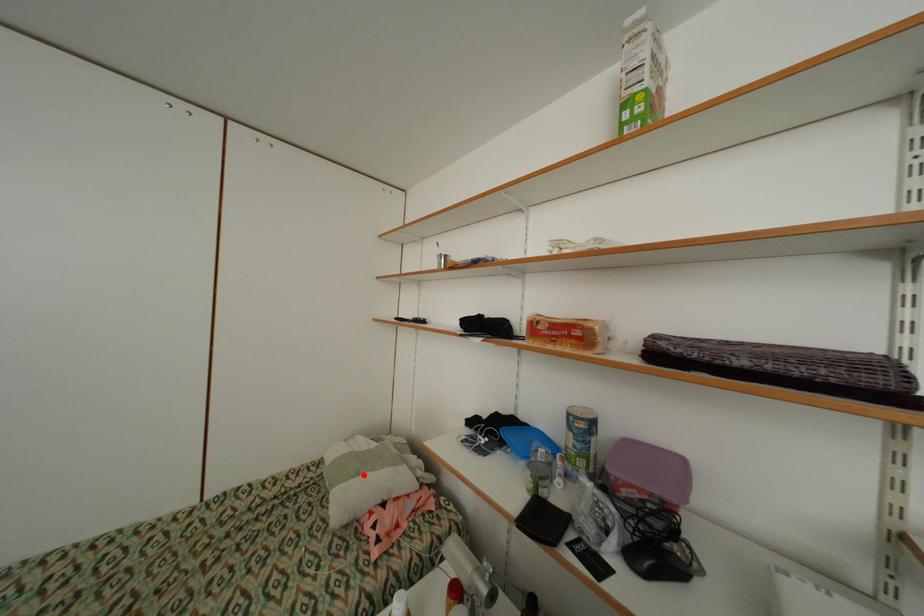
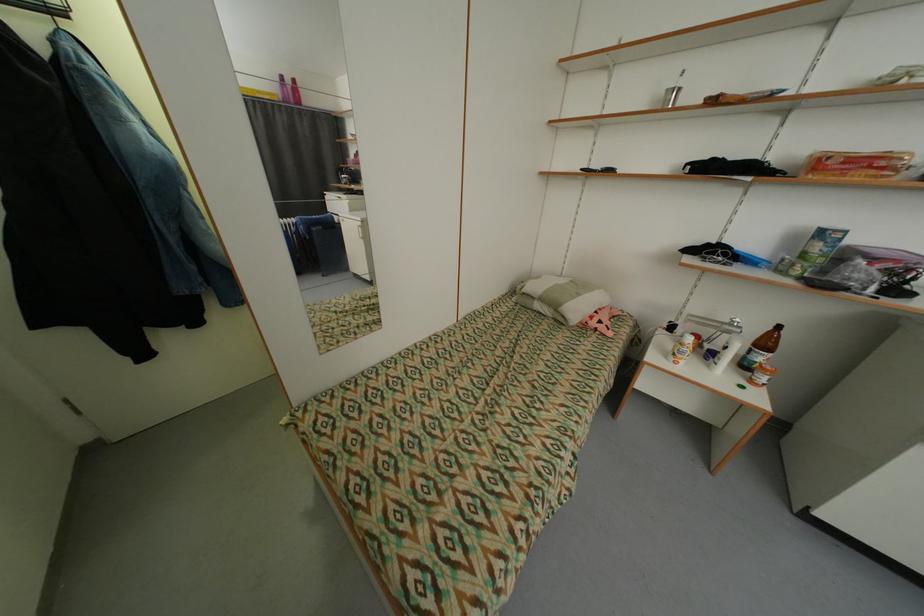
Question: I am providing you with two images of the same scene from different viewpoints. A red point is shown in image1. For the corresponding object point in image2, is it positioned nearer or farther from the camera?

Choices:
 (A) Nearer
 (B) Farther

Answer: (A)